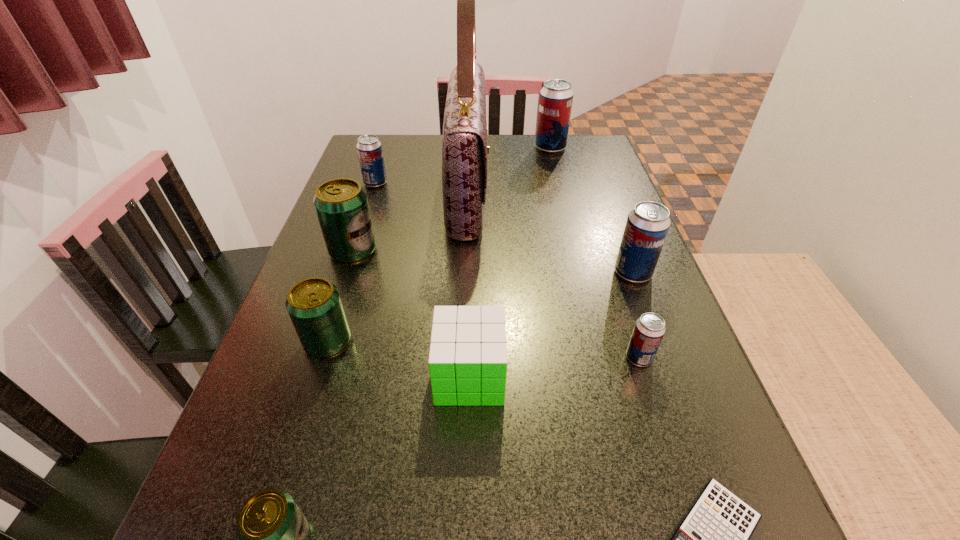
Image resolution: width=960 pixels, height=540 pixels. Identify the location of vacant area that lies between the handbag and the smallest red beer can. (554, 275).

Point out which object is positioned as the ninth nearest to the cube. Please provide its 2D coordinates. Your answer should be formatted as a tuple, i.e. [(x, y)], where the tuple contains the x and y coordinates of a point satisfying the conditions above.

[(556, 97)]

Where is `the second closest object to the tallest object`? The width and height of the screenshot is (960, 540). the second closest object to the tallest object is located at coordinates (556, 97).

Point out which beer can is positioned as the sixth nearest to the third nearest red beer can. Please provide its 2D coordinates. Your answer should be formatted as a tuple, i.e. [(x, y)], where the tuple contains the x and y coordinates of a point satisfying the conditions above.

[(274, 535)]

Locate which beer can ranks second in proximity to the leftmost red beer can. Please provide its 2D coordinates. Your answer should be formatted as a tuple, i.e. [(x, y)], where the tuple contains the x and y coordinates of a point satisfying the conditions above.

[(556, 97)]

Locate which red beer can is the third closest to the cube. Please provide its 2D coordinates. Your answer should be formatted as a tuple, i.e. [(x, y)], where the tuple contains the x and y coordinates of a point satisfying the conditions above.

[(369, 148)]

Identify the location of red beer can that is the closest one to the second farthest green beer can. (369, 148).

Locate which green beer can ranks in proximity to the cube. Please provide its 2D coordinates. Your answer should be formatted as a tuple, i.e. [(x, y)], where the tuple contains the x and y coordinates of a point satisfying the conditions above.

[(314, 305)]

Identify which green beer can is located as the nearest to the smallest green beer can. Please provide its 2D coordinates. Your answer should be formatted as a tuple, i.e. [(x, y)], where the tuple contains the x and y coordinates of a point satisfying the conditions above.

[(314, 305)]

Find the location of a particular element. vacant space that satisfies the following two spatial constraints: 1. on the front side of the farthest red beer can; 2. on the right side of the third smallest red beer can is located at coordinates (582, 273).